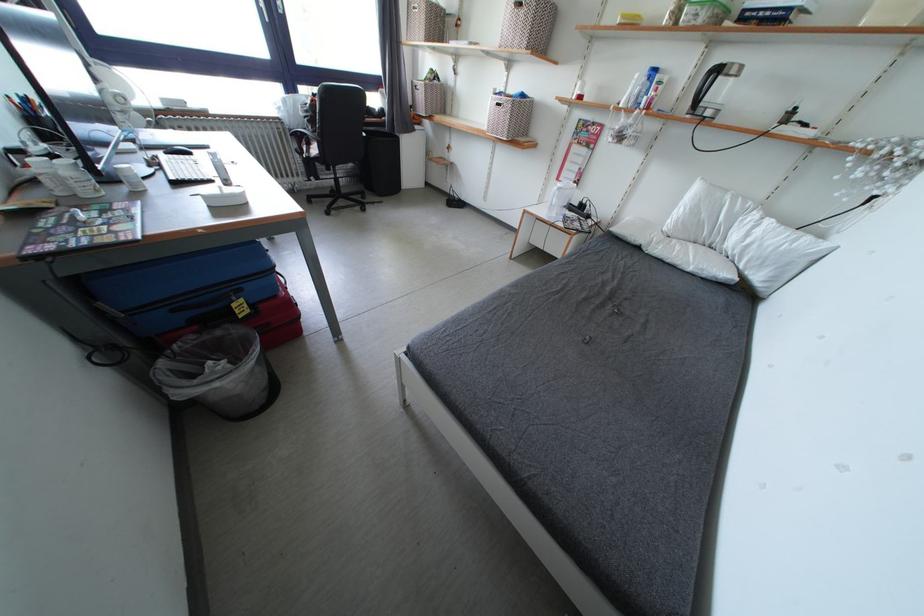
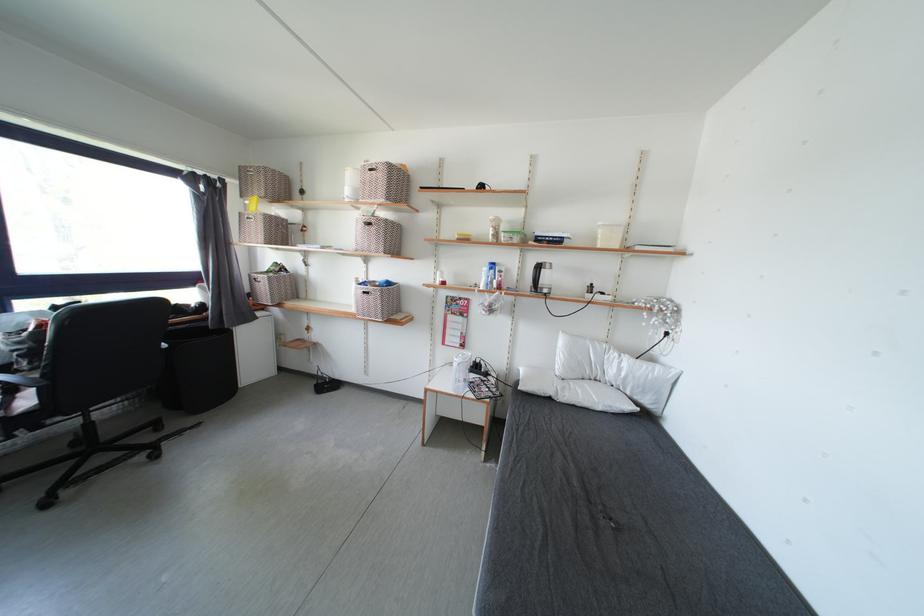
The point at (x=322, y=156) is marked in the first image. Where is the corresponding point in the second image?

(33, 407)